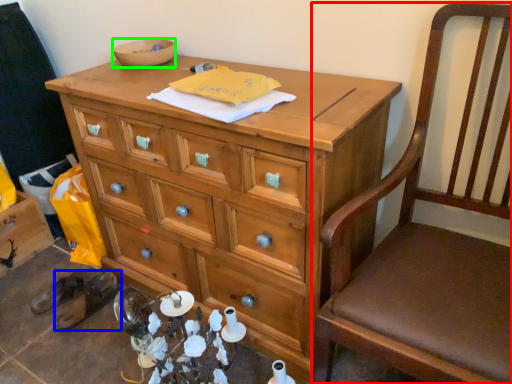
Question: Based on their relative distances, which object is nearer to chair (highlighted by a red box)? Choose from footwear (highlighted by a blue box) and bowl (highlighted by a green box).

Choices:
 (A) footwear
 (B) bowl

Answer: (B)